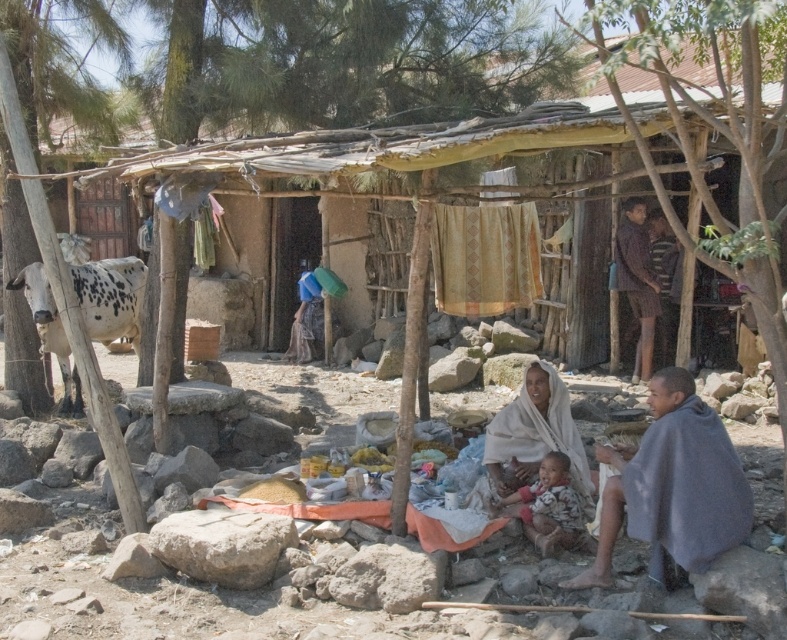
You are a traveler who needs to place a small bag on either the gray rough rock at lower left or the striped shirt at upper right. Which object can better support the bag based on their sizes?

The striped shirt at upper right is larger than the gray rough rock at lower left, so it can better support the bag.

You are a traveler standing at the entrance of the hut. You see a point marked at coordinates (671, 484). Which object is this point located on?

The point at coordinates (671, 484) is located on the gray woolen shawl at lower right.